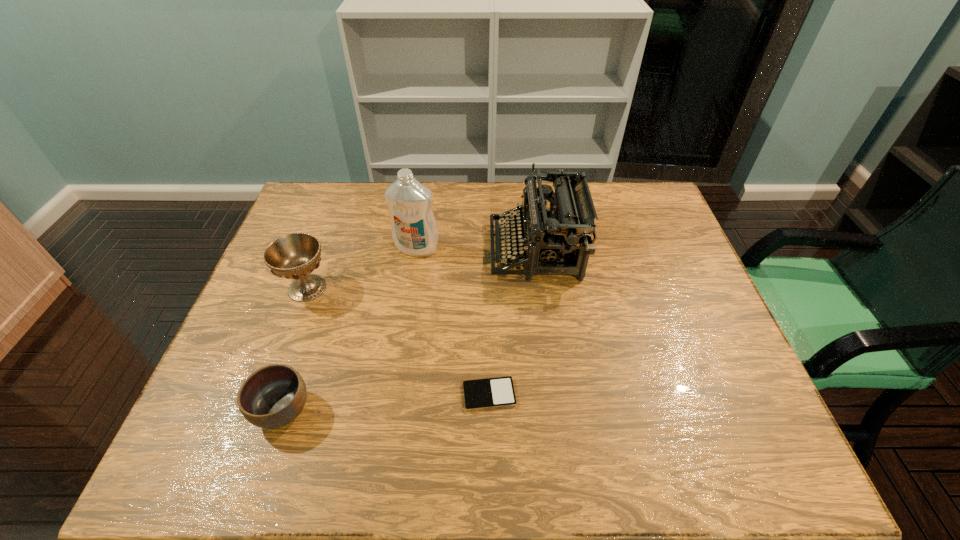
The height and width of the screenshot is (540, 960). I want to click on free space between the iPod and the second tallest object, so click(513, 322).

At what (x,y) coordinates should I click in order to perform the action: click on vacant space that's between the tallest object and the bowl. Please return your answer as a coordinate pair (x, y). Looking at the image, I should click on (349, 329).

Choose which object is the fourth nearest neighbor to the shortest object. Please provide its 2D coordinates. Your answer should be formatted as a tuple, i.e. [(x, y)], where the tuple contains the x and y coordinates of a point satisfying the conditions above.

[(295, 256)]

This screenshot has width=960, height=540. I want to click on object that stands as the closest to the third tallest object, so click(414, 230).

You are a GUI agent. You are given a task and a screenshot of the screen. Output one action in this format:
    pyautogui.click(x=<x>, y=<y>)
    Task: Click on the free point that satisfies the following two spatial constraints: 1. on the back side of the detergent; 2. on the left side of the third shortest object
    The height and width of the screenshot is (540, 960).
    Given the screenshot: What is the action you would take?
    pyautogui.click(x=322, y=248)